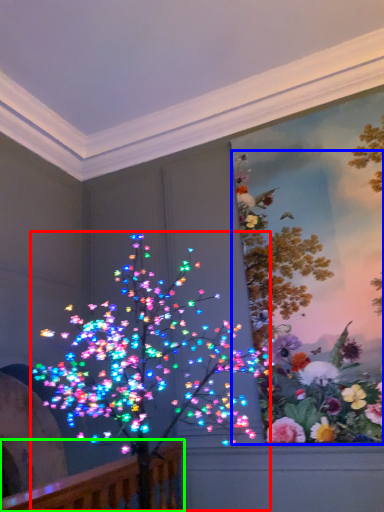
Question: Which object is the closest to the christmas decoration (highlighted by a red box)? Choose among these: floral arrangement (highlighted by a blue box) or rail (highlighted by a green box).

Choices:
 (A) floral arrangement
 (B) rail

Answer: (A)